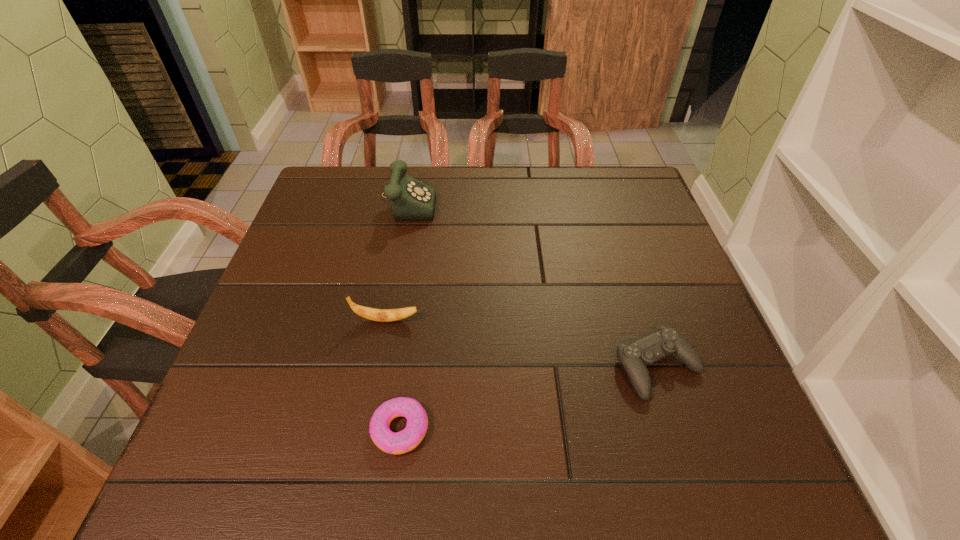
Where is `vacant region at the near left corner of the desktop`? The width and height of the screenshot is (960, 540). vacant region at the near left corner of the desktop is located at coordinates (252, 480).

In order to click on free region at the far right corner of the desktop in this screenshot , I will do `click(604, 167)`.

The height and width of the screenshot is (540, 960). Find the location of `empty space that is in between the nearest object and the banana`. empty space that is in between the nearest object and the banana is located at coordinates (394, 375).

Where is `free space between the farthest object and the third farthest object`? The width and height of the screenshot is (960, 540). free space between the farthest object and the third farthest object is located at coordinates (533, 284).

The width and height of the screenshot is (960, 540). Find the location of `vacant area that lies between the farthest object and the third farthest object`. vacant area that lies between the farthest object and the third farthest object is located at coordinates (533, 284).

The height and width of the screenshot is (540, 960). I want to click on vacant area between the third tallest object and the second tallest object, so click(x=522, y=344).

Identify the location of vacant area that lies between the control and the nearest object. (529, 399).

Where is `unoccupied area between the control and the second farthest object`? unoccupied area between the control and the second farthest object is located at coordinates (522, 344).

Image resolution: width=960 pixels, height=540 pixels. I want to click on free space between the tallest object and the rightmost object, so click(533, 284).

The width and height of the screenshot is (960, 540). Find the location of `the closest object to the second shortest object`. the closest object to the second shortest object is located at coordinates [x=410, y=437].